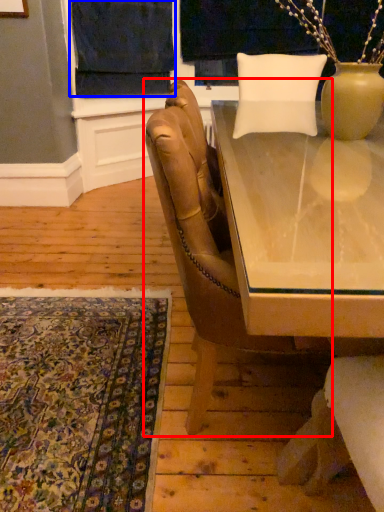
Question: Which of the following is the farthest to the observer, chair (highlighted by a red box) or curtain (highlighted by a blue box)?

Choices:
 (A) chair
 (B) curtain

Answer: (B)